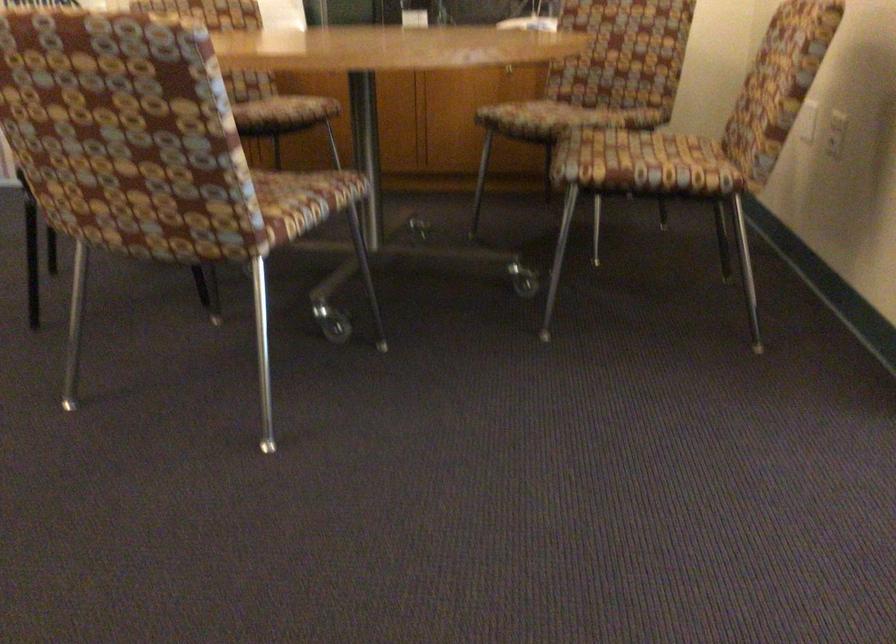
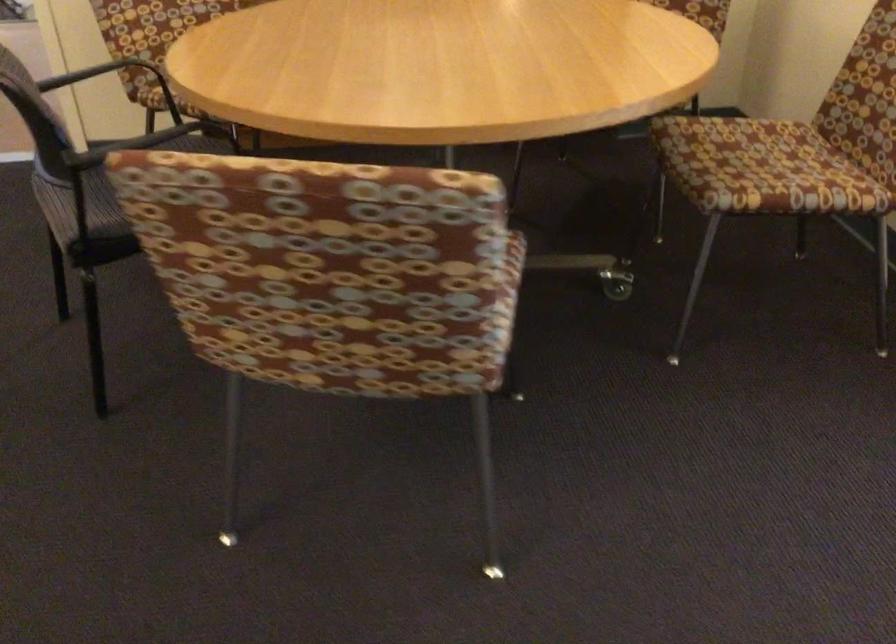
Locate, in the second image, the point that corresponds to the point at 625,167 in the first image.

(778, 187)